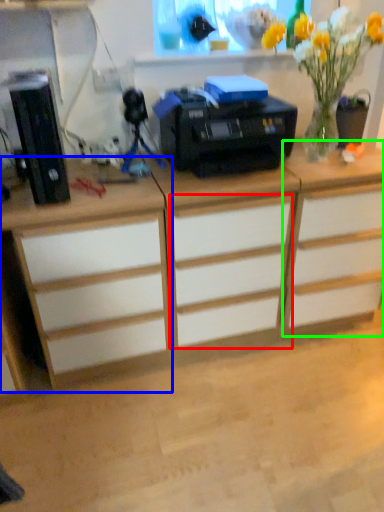
Question: Based on their relative distances, which object is farther from drawer (highlighted by a red box)? Choose from desk (highlighted by a blue box) and cabinetry (highlighted by a green box).

Choices:
 (A) desk
 (B) cabinetry

Answer: (A)